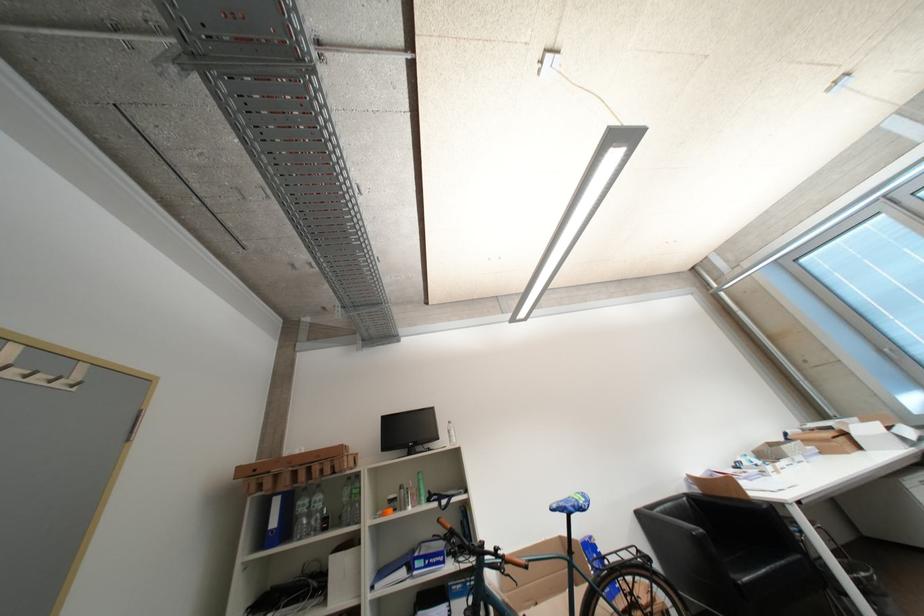
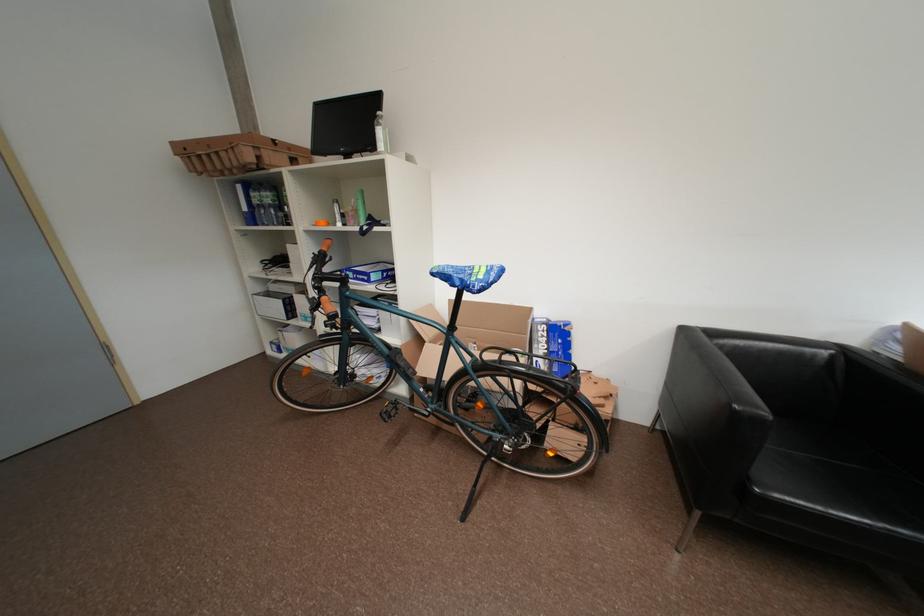
Where in the second image is the point corresponding to [658,562] from the first image?

(582, 391)